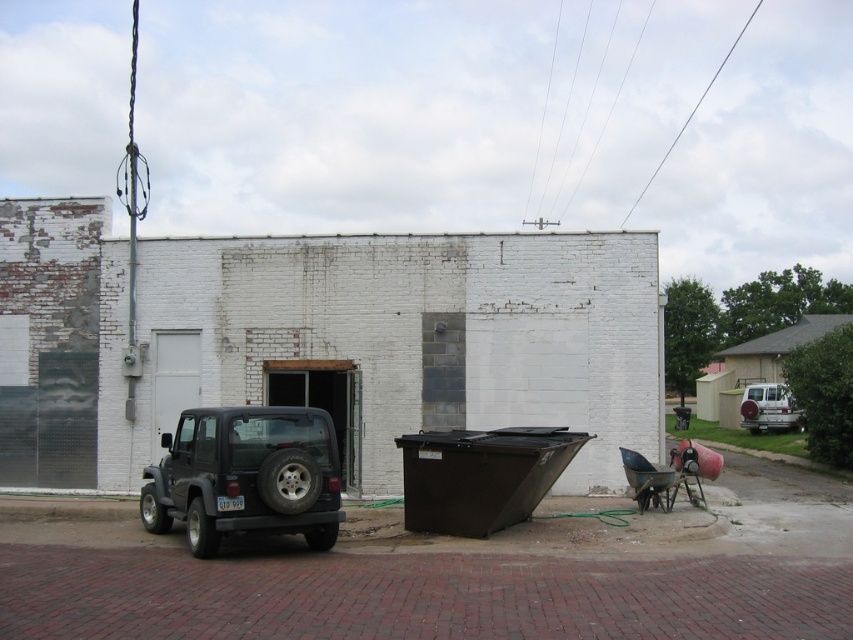
Who is positioned more to the left, matte black suv at left or silver metallic suv at right?

From the viewer's perspective, matte black suv at left appears more on the left side.

Is point (289, 467) less distant than point (747, 412)?

Yes, point (289, 467) is in front of point (747, 412).

Find the location of a particular element. This screenshot has width=853, height=640. matte black suv at left is located at coordinates (247, 476).